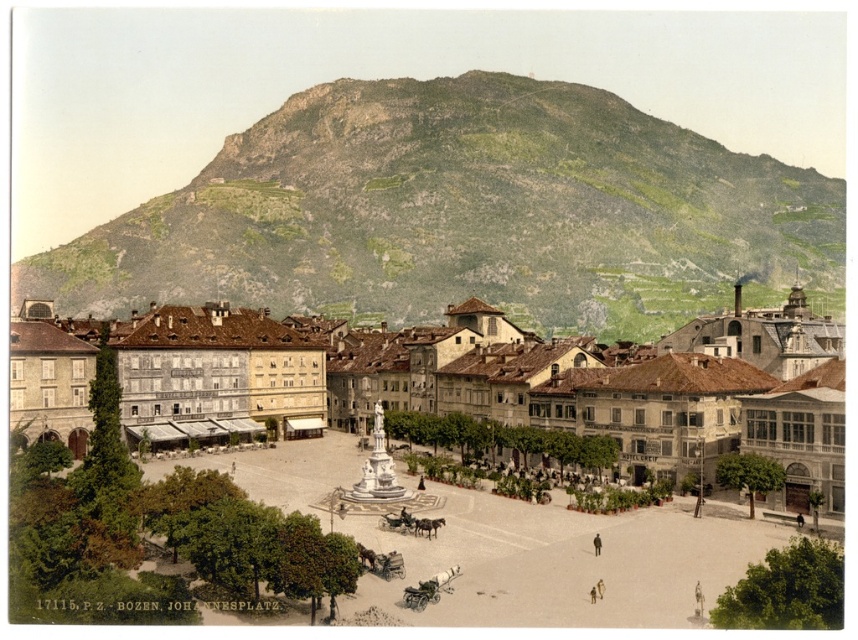
Is matte stone fountain at center below dark brown coat at center?

Actually, matte stone fountain at center is above dark brown coat at center.

Who is more distant from viewer, (208, 433) or (599, 536)?

Positioned behind is point (208, 433).

I want to click on matte stone fountain at center, so click(498, 387).

Measure the distance between green grassy mountain at upper center and dark brown coat at center.

green grassy mountain at upper center is 742.36 feet from dark brown coat at center.

Who is more distant from viewer, [735,154] or [600,540]?

Positioned behind is point [735,154].

Is point (270, 280) behind point (594, 547)?

Yes.

Where is `green grassy mountain at upper center`? Image resolution: width=858 pixels, height=640 pixels. green grassy mountain at upper center is located at coordinates (464, 212).

Which is more to the right, green grassy mountain at upper center or matte stone fountain at center?

Positioned to the right is matte stone fountain at center.

Is point (608, 317) farther from viewer compared to point (808, 356)?

Yes, it is behind point (808, 356).

Identify the location of green grassy mountain at upper center. This screenshot has width=858, height=640. (464, 212).